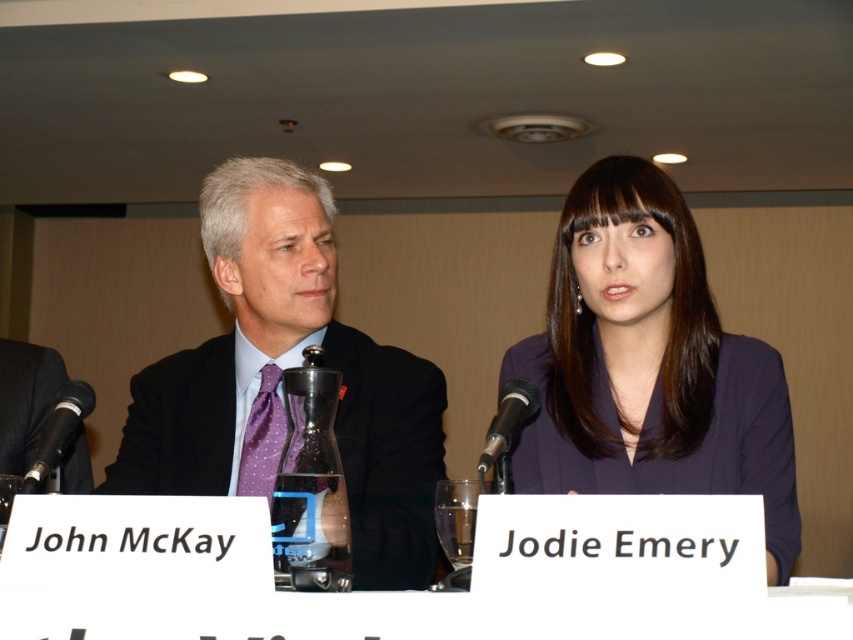
In the scene shown: Can you confirm if purple matte blazer at center is taller than black metallic microphone at center?

Yes.

Does purple matte blazer at center have a greater width compared to black metallic microphone at center?

Yes, purple matte blazer at center is wider than black metallic microphone at center.

I want to click on purple matte blazer at center, so click(x=648, y=364).

Identify the location of purple matte blazer at center. This screenshot has width=853, height=640. (648, 364).

The height and width of the screenshot is (640, 853). I want to click on matte black suit at left, so click(x=280, y=378).

Which is in front, point (273, 195) or point (68, 435)?

Point (68, 435) is more forward.

The width and height of the screenshot is (853, 640). I want to click on matte black suit at left, so click(280, 378).

Identify the location of matte black suit at left. pyautogui.click(x=280, y=378).

Who is more distant from viewer, [595,211] or [282,406]?

Positioned behind is point [282,406].

Between purple matte blazer at center and matte black suit at left, which one is positioned lower?

Positioned lower is matte black suit at left.

Between point (630, 461) and point (438, 401), which one is positioned in front?

Point (630, 461)

Where is `purple matte blazer at center`? The height and width of the screenshot is (640, 853). purple matte blazer at center is located at coordinates (648, 364).